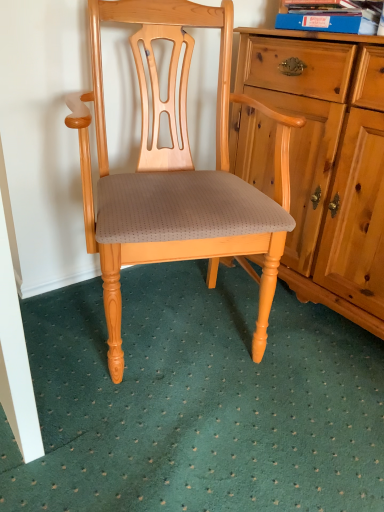
Describe the element at coordinates (178, 183) in the screenshot. The height and width of the screenshot is (512, 384). I see `matte wood chair at center` at that location.

This screenshot has width=384, height=512. What do you see at coordinates (328, 16) in the screenshot? I see `blue cardboard book at upper right` at bounding box center [328, 16].

Locate an element on the screen. Image resolution: width=384 pixels, height=512 pixels. matte wood chair at center is located at coordinates (178, 183).

Is blue cardboard book at upper right facing away from matte wood chair at center?

blue cardboard book at upper right is not turned away from matte wood chair at center.

In the image, is blue cardboard book at upper right positioned in front of or behind matte wood chair at center?

blue cardboard book at upper right is positioned farther from the viewer than matte wood chair at center.

Which is behind, point (374, 18) or point (143, 74)?

The point (143, 74) is farther from the camera.

Does blue cardboard book at upper right turn towards green textured carpet at lower center?

No, blue cardboard book at upper right is not oriented towards green textured carpet at lower center.

Based on the photo, considering the relative sizes of blue cardboard book at upper right and green textured carpet at lower center in the image provided, is blue cardboard book at upper right thinner than green textured carpet at lower center?

Yes.

From a real-world perspective, is blue cardboard book at upper right physically located above or below green textured carpet at lower center?

blue cardboard book at upper right is above green textured carpet at lower center.

From a real-world perspective, between matte wood chair at center and green textured carpet at lower center, who is vertically lower?

From a 3D spatial view, green textured carpet at lower center is below.

This screenshot has width=384, height=512. In order to click on doormat in front of the matte wood chair at center in this screenshot , I will do `click(198, 402)`.

Considering the positions of objects matte wood chair at center and green textured carpet at lower center in the image provided, who is more to the left, matte wood chair at center or green textured carpet at lower center?

matte wood chair at center.

Locate an element on the screen. This screenshot has height=512, width=384. chair beneath the blue cardboard book at upper right (from a real-world perspective) is located at coordinates (178, 183).

Can you confirm if matte wood chair at center is shorter than blue cardboard book at upper right?

No.

From the image's perspective, which is above, matte wood chair at center or blue cardboard book at upper right?

blue cardboard book at upper right is shown above in the image.

Considering their positions, is matte wood chair at center located in front of or behind blue cardboard book at upper right?

matte wood chair at center is in front of blue cardboard book at upper right.

Does green textured carpet at lower center have a lesser height compared to matte wood chair at center?

Indeed, green textured carpet at lower center has a lesser height compared to matte wood chair at center.

Is green textured carpet at lower center aimed at matte wood chair at center?

No, green textured carpet at lower center is not facing towards matte wood chair at center.

Visually, is green textured carpet at lower center positioned to the left or to the right of matte wood chair at center?

green textured carpet at lower center is positioned on matte wood chair at center's right side.

Considering the relative positions of green textured carpet at lower center and matte wood chair at center in the image provided, is green textured carpet at lower center in front of matte wood chair at center?

Yes, the depth of green textured carpet at lower center is less than that of matte wood chair at center.

Considering the positions of point (227, 398) and point (343, 5), is point (227, 398) closer or farther from the camera than point (343, 5)?

Point (227, 398) appears to be closer to the viewer than point (343, 5).

Based on their positions, is green textured carpet at lower center located to the left or right of blue cardboard book at upper right?

Based on their positions, green textured carpet at lower center is located to the left of blue cardboard book at upper right.

Considering the sizes of objects green textured carpet at lower center and blue cardboard book at upper right in the image provided, who is smaller, green textured carpet at lower center or blue cardboard book at upper right?

Smaller between the two is blue cardboard book at upper right.

Is green textured carpet at lower center looking in the opposite direction of blue cardboard book at upper right?

No.

The width and height of the screenshot is (384, 512). I want to click on chair that is under the blue cardboard book at upper right (from a real-world perspective), so (x=178, y=183).

Find the location of a particular element. The width and height of the screenshot is (384, 512). doormat on the left of blue cardboard book at upper right is located at coordinates (198, 402).

Looking at this image, looking at the image, which one is located closer to green textured carpet at lower center, matte wood chair at center or blue cardboard book at upper right?

matte wood chair at center lies closer to green textured carpet at lower center than the other object.

Estimate the real-world distances between objects in this image. Which object is further from blue cardboard book at upper right, matte wood chair at center or green textured carpet at lower center?

Among the two, green textured carpet at lower center is located further to blue cardboard book at upper right.

Estimate the real-world distances between objects in this image. Which object is closer to blue cardboard book at upper right, green textured carpet at lower center or matte wood chair at center?

matte wood chair at center lies closer to blue cardboard book at upper right than the other object.

Looking at the image, which one is located closer to matte wood chair at center, green textured carpet at lower center or blue cardboard book at upper right?

Among the two, green textured carpet at lower center is located nearer to matte wood chair at center.

From the image, which object appears to be farther from green textured carpet at lower center, blue cardboard book at upper right or matte wood chair at center?

blue cardboard book at upper right is further to green textured carpet at lower center.

From the image, which object appears to be nearer to matte wood chair at center, blue cardboard book at upper right or green textured carpet at lower center?

The object closer to matte wood chair at center is green textured carpet at lower center.

Find the location of `chair between blue cardboard book at upper right and green textured carpet at lower center from top to bottom`. chair between blue cardboard book at upper right and green textured carpet at lower center from top to bottom is located at coordinates (178, 183).